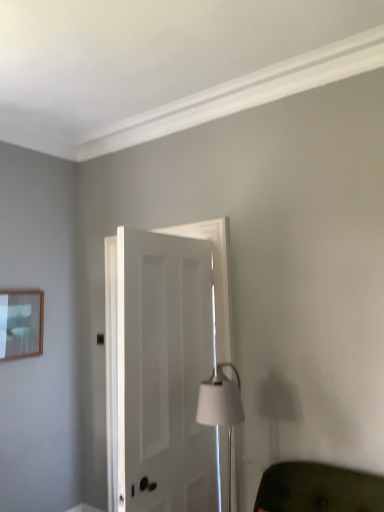
Question: Are wooden picture frame at upper left and white matte table lamp at center far apart?

Choices:
 (A) no
 (B) yes

Answer: (B)

Question: Does wooden picture frame at upper left have a greater height compared to white matte table lamp at center?

Choices:
 (A) yes
 (B) no

Answer: (B)

Question: From a real-world perspective, is wooden picture frame at upper left located beneath white matte table lamp at center?

Choices:
 (A) no
 (B) yes

Answer: (A)

Question: Is white matte table lamp at center completely or partially inside wooden picture frame at upper left?

Choices:
 (A) no
 (B) yes

Answer: (A)

Question: From a real-world perspective, is wooden picture frame at upper left positioned over white matte table lamp at center based on gravity?

Choices:
 (A) yes
 (B) no

Answer: (A)

Question: In terms of size, does green fabric couch at lower right appear bigger or smaller than wooden picture frame at upper left?

Choices:
 (A) big
 (B) small

Answer: (A)

Question: From a real-world perspective, is green fabric couch at lower right positioned above or below wooden picture frame at upper left?

Choices:
 (A) below
 (B) above

Answer: (A)

Question: Is green fabric couch at lower right spatially inside wooden picture frame at upper left, or outside of it?

Choices:
 (A) inside
 (B) outside

Answer: (B)

Question: From the image's perspective, is green fabric couch at lower right above or below wooden picture frame at upper left?

Choices:
 (A) below
 (B) above

Answer: (A)

Question: Is wooden picture frame at upper left taller or shorter than green fabric couch at lower right?

Choices:
 (A) short
 (B) tall

Answer: (B)

Question: From the image's perspective, is wooden picture frame at upper left positioned above or below green fabric couch at lower right?

Choices:
 (A) above
 (B) below

Answer: (A)

Question: Considering the positions of point (41, 306) and point (352, 506), is point (41, 306) closer or farther from the camera than point (352, 506)?

Choices:
 (A) farther
 (B) closer

Answer: (A)

Question: From a real-world perspective, is wooden picture frame at upper left above or below green fabric couch at lower right?

Choices:
 (A) above
 (B) below

Answer: (A)

Question: Is wooden picture frame at upper left inside the boundaries of white matte door at center, or outside?

Choices:
 (A) outside
 (B) inside

Answer: (A)

Question: Is point (31, 347) positioned closer to the camera than point (148, 456)?

Choices:
 (A) closer
 (B) farther

Answer: (B)